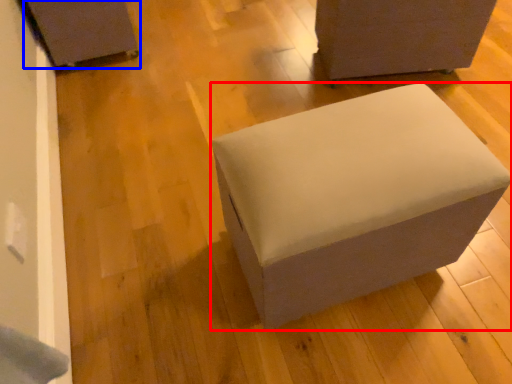
Question: Among these objects, which one is farthest to the camera, furniture (highlighted by a red box) or furniture (highlighted by a blue box)?

Choices:
 (A) furniture
 (B) furniture

Answer: (B)